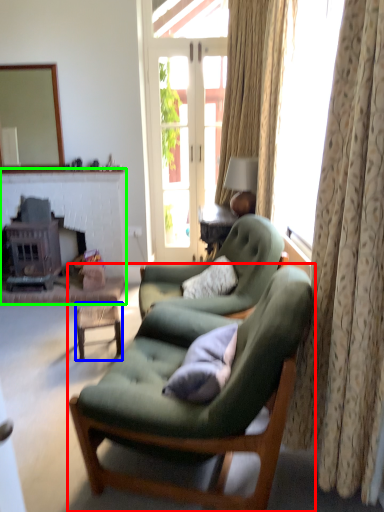
Question: Which object is the farthest from chair (highlighted by a red box)? Choose among these: table (highlighted by a blue box) or fireplace (highlighted by a green box).

Choices:
 (A) table
 (B) fireplace

Answer: (B)